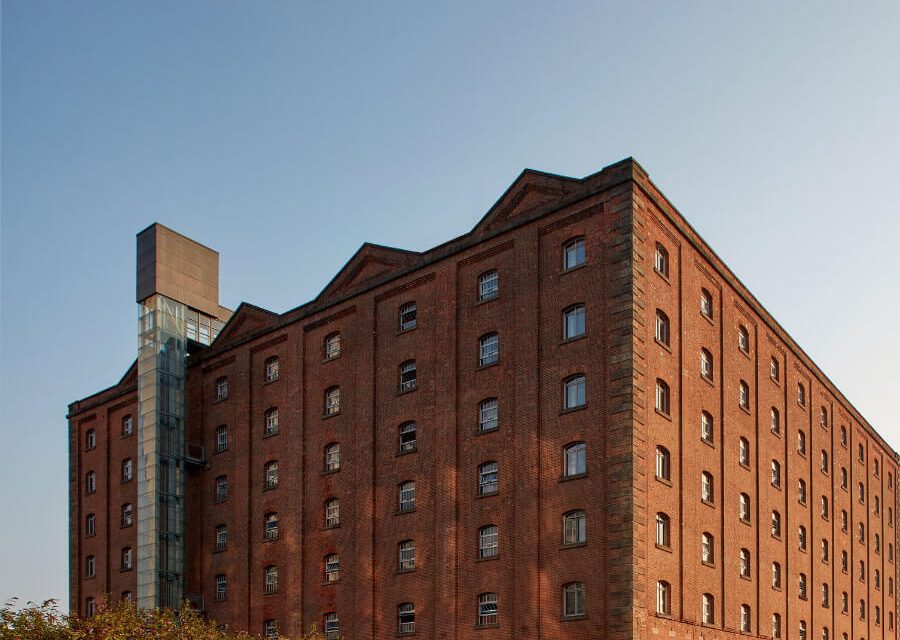
Locate an element on the screen. Image resolution: width=900 pixels, height=640 pixels. glass is located at coordinates (172, 330).